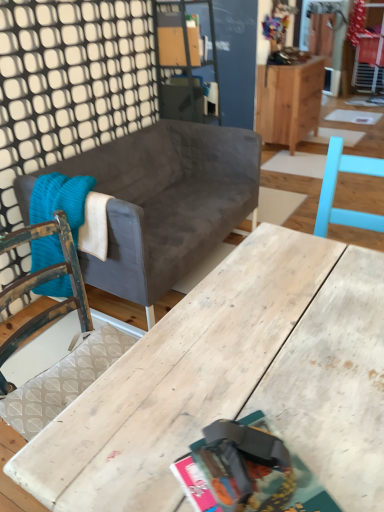
What do you see at coordinates (61, 199) in the screenshot?
I see `knitted wool blanket at left` at bounding box center [61, 199].

The height and width of the screenshot is (512, 384). Describe the element at coordinates (248, 471) in the screenshot. I see `matte paper magazine at center` at that location.

Locate an element on the screen. This screenshot has height=512, width=384. wooden table at center is located at coordinates (234, 381).

What is the approximate height of wooden table at center?

wooden table at center is 29.78 inches tall.

This screenshot has width=384, height=512. Describe the element at coordinates (163, 201) in the screenshot. I see `velvet gray couch at center` at that location.

Find the location of a particular element. This screenshot has height=512, width=384. knitted wool blanket at left is located at coordinates (61, 199).

Between knitted wool blanket at left and wooden cabinet at upper right, which one appears on the left side from the viewer's perspective?

knitted wool blanket at left is more to the left.

Does knitted wool blanket at left have a lesser height compared to wooden cabinet at upper right?

Yes.

Locate an element on the screen. blanket in front of the wooden cabinet at upper right is located at coordinates (61, 199).

Does knitted wool blanket at left come behind wooden cabinet at upper right?

No, knitted wool blanket at left is closer to the camera.

Considering the sizes of objects wooden table at center and knitted wool blanket at left in the image provided, who is shorter, wooden table at center or knitted wool blanket at left?

With less height is knitted wool blanket at left.

Does wooden table at center lie behind knitted wool blanket at left?

That is False.

Can you confirm if wooden table at center is bigger than knitted wool blanket at left?

Correct, wooden table at center is larger in size than knitted wool blanket at left.

The image size is (384, 512). In order to click on blanket above the wooden table at center (from a real-world perspective) in this screenshot , I will do `click(61, 199)`.

How many degrees apart are the facing directions of velvet gray couch at center and wooden table at center?

They differ by 88.1 degrees in their facing directions.

Is velvet gray couch at center outside of wooden table at center?

Indeed, velvet gray couch at center is completely outside wooden table at center.

Is point (150, 181) positioned after point (281, 274)?

Yes, point (150, 181) is farther from viewer.

Looking at this image, from the image's perspective, who appears lower, velvet gray couch at center or wooden table at center?

wooden table at center, from the image's perspective.

How many degrees apart are the facing directions of knitted wool blanket at left and wooden table at center?

They differ by 179 degrees in their facing directions.

Which is in front, point (74, 213) or point (135, 381)?

The point (135, 381) is closer.

From the image's perspective, does knitted wool blanket at left appear lower than wooden table at center?

No.

From the image's perspective, who appears lower, wooden cabinet at upper right or knitted wool blanket at left?

knitted wool blanket at left.

Based on the photo, is wooden cabinet at upper right thinner than knitted wool blanket at left?

In fact, wooden cabinet at upper right might be wider than knitted wool blanket at left.

How many degrees apart are the facing directions of wooden cabinet at upper right and knitted wool blanket at left?

There is a 90.7-degree angle between the facing directions of wooden cabinet at upper right and knitted wool blanket at left.

Image resolution: width=384 pixels, height=512 pixels. I want to click on cabinetry below the knitted wool blanket at left (from a real-world perspective), so click(289, 101).

From the image's perspective, does velvet gray couch at center appear higher than wooden cabinet at upper right?

No, from the image's perspective, velvet gray couch at center is not on top of wooden cabinet at upper right.

Based on their positions, is velvet gray couch at center located to the left or right of wooden cabinet at upper right?

From the image, it's evident that velvet gray couch at center is to the left of wooden cabinet at upper right.

Locate an element on the screen. The image size is (384, 512). cabinetry above the velvet gray couch at center (from a real-world perspective) is located at coordinates (289, 101).

From a real-world perspective, who is located higher, velvet gray couch at center or wooden cabinet at upper right?

wooden cabinet at upper right, from a real-world perspective.

Is wooden table at center wider or thinner than matte paper magazine at center?

wooden table at center is wider than matte paper magazine at center.

Is point (369, 474) closer to camera compared to point (260, 497)?

That is False.

Do you think wooden table at center is within matte paper magazine at center, or outside of it?

wooden table at center is outside matte paper magazine at center.

At what (x,y) coordinates should I click in order to perform the action: click on cabinetry on the right of knitted wool blanket at left. Please return your answer as a coordinate pair (x, y). The image size is (384, 512). Looking at the image, I should click on (289, 101).

There is a wooden table at center. At what (x,y) coordinates should I click in order to perform the action: click on blanket above it (from a real-world perspective). Please return your answer as a coordinate pair (x, y). This screenshot has width=384, height=512. Looking at the image, I should click on (61, 199).

When comparing their distances from wooden table at center, does velvet gray couch at center or wooden cabinet at upper right seem closer?

The object closer to wooden table at center is velvet gray couch at center.

When comparing their distances from wooden table at center, does knitted wool blanket at left or matte paper magazine at center seem closer?

matte paper magazine at center is positioned closer to the anchor wooden table at center.

Which object lies nearer to the anchor point wooden cabinet at upper right, matte paper magazine at center or wooden table at center?

wooden table at center is positioned closer to the anchor wooden cabinet at upper right.

In the scene shown: Based on their spatial positions, is knitted wool blanket at left or wooden table at center further from wooden cabinet at upper right?

The object further to wooden cabinet at upper right is wooden table at center.

Looking at the image, which one is located further to velvet gray couch at center, knitted wool blanket at left or wooden cabinet at upper right?

Among the two, wooden cabinet at upper right is located further to velvet gray couch at center.

Which object lies nearer to the anchor point matte paper magazine at center, wooden table at center or velvet gray couch at center?

wooden table at center is positioned closer to the anchor matte paper magazine at center.

Estimate the real-world distances between objects in this image. Which object is closer to matte paper magazine at center, wooden cabinet at upper right or velvet gray couch at center?

Among the two, velvet gray couch at center is located nearer to matte paper magazine at center.

When comparing their distances from knitted wool blanket at left, does wooden table at center or wooden cabinet at upper right seem closer?

Based on the image, wooden table at center appears to be nearer to knitted wool blanket at left.

Locate an element on the screen. This screenshot has height=512, width=384. blanket between wooden table at center and wooden cabinet at upper right in the front-back direction is located at coordinates (61, 199).

Locate an element on the screen. magazine between wooden table at center and knitted wool blanket at left from front to back is located at coordinates (248, 471).

Locate an element on the screen. This screenshot has height=512, width=384. studio couch located between wooden table at center and wooden cabinet at upper right in the depth direction is located at coordinates (163, 201).

What are the coordinates of `studio couch located between matte paper magazine at center and knitted wool blanket at left in the depth direction` in the screenshot? It's located at (163, 201).